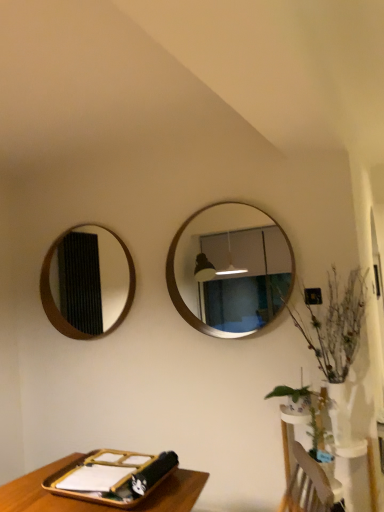
Question: Can you confirm if green leafy plant at right is bigger than white glossy vase at lower right?

Choices:
 (A) no
 (B) yes

Answer: (A)

Question: Is green leafy plant at right oriented towards white glossy vase at lower right?

Choices:
 (A) yes
 (B) no

Answer: (B)

Question: Considering the relative positions of green leafy plant at right and white glossy vase at lower right in the image provided, is green leafy plant at right to the left of white glossy vase at lower right from the viewer's perspective?

Choices:
 (A) yes
 (B) no

Answer: (B)

Question: From a real-world perspective, is green leafy plant at right over white glossy vase at lower right?

Choices:
 (A) no
 (B) yes

Answer: (B)

Question: Is green leafy plant at right wider than white glossy vase at lower right?

Choices:
 (A) no
 (B) yes

Answer: (A)

Question: Is white glossy vase at lower right inside or outside of green matte plant at lower right?

Choices:
 (A) outside
 (B) inside

Answer: (A)

Question: In terms of height, does white glossy vase at lower right look taller or shorter compared to green matte plant at lower right?

Choices:
 (A) tall
 (B) short

Answer: (A)

Question: From the image's perspective, is white glossy vase at lower right located above or below green matte plant at lower right?

Choices:
 (A) below
 (B) above

Answer: (A)

Question: From a real-world perspective, is white glossy vase at lower right positioned above or below green matte plant at lower right?

Choices:
 (A) above
 (B) below

Answer: (B)

Question: In the image, is green matte plant at lower right positioned in front of or behind wooden mirror at left, the second mirror in the right-to-left sequence?

Choices:
 (A) front
 (B) behind

Answer: (A)

Question: Considering the relative positions of green matte plant at lower right and wooden mirror at left, the first mirror in the back-to-front sequence, in the image provided, is green matte plant at lower right to the left or to the right of wooden mirror at left, the first mirror in the back-to-front sequence,?

Choices:
 (A) left
 (B) right

Answer: (B)

Question: From the image's perspective, is green matte plant at lower right located above or below wooden mirror at left, acting as the second mirror starting from the front?

Choices:
 (A) above
 (B) below

Answer: (B)

Question: Is green matte plant at lower right taller or shorter than wooden mirror at left, which is the 1th mirror in left-to-right order?

Choices:
 (A) tall
 (B) short

Answer: (B)

Question: Looking at their shapes, would you say wooden framed mirror at center, arranged as the first mirror when viewed from the front, is wider or thinner than green leafy plant at right?

Choices:
 (A) thin
 (B) wide

Answer: (A)

Question: Considering their positions, is wooden framed mirror at center, placed as the 2th mirror when sorted from left to right, located in front of or behind green leafy plant at right?

Choices:
 (A) front
 (B) behind

Answer: (B)